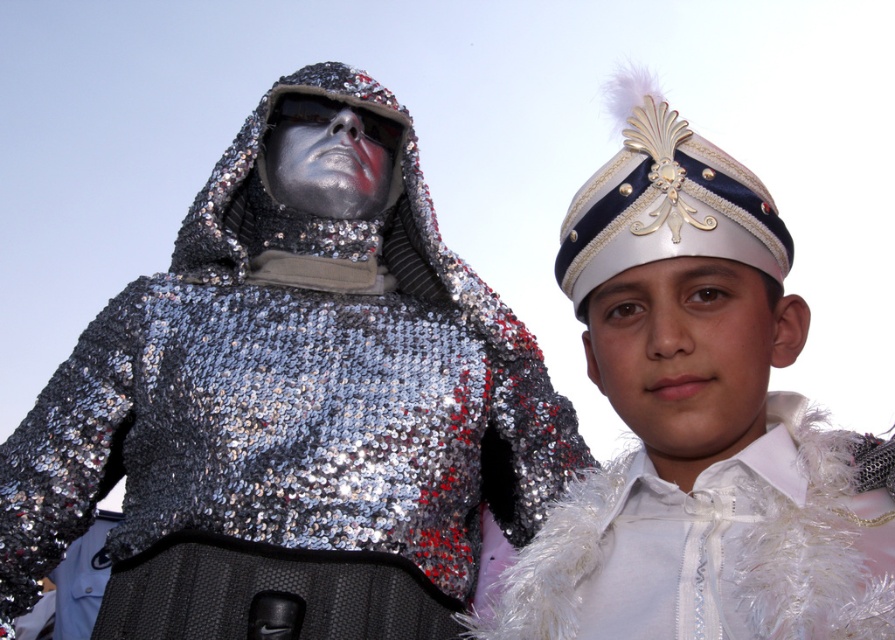
Is shiny metallic armor at left further to the viewer compared to white feathered hat at upper right?

Yes, it is.

The image size is (895, 640). What do you see at coordinates (297, 369) in the screenshot? I see `shiny metallic armor at left` at bounding box center [297, 369].

At what (x,y) coordinates should I click in order to perform the action: click on shiny metallic armor at left. Please return your answer as a coordinate pair (x, y). Looking at the image, I should click on (297, 369).

Measure the distance from shiny metallic armor at left to white satin headdress at upper right.

shiny metallic armor at left is 32.36 feet away from white satin headdress at upper right.

Can you confirm if shiny metallic armor at left is positioned to the right of white satin headdress at upper right?

In fact, shiny metallic armor at left is to the left of white satin headdress at upper right.

Find the location of a particular element. shiny metallic armor at left is located at coordinates (297, 369).

Does white feathered hat at upper right have a greater height compared to white satin headdress at upper right?

Indeed, white feathered hat at upper right has a greater height compared to white satin headdress at upper right.

Who is taller, white feathered hat at upper right or white satin headdress at upper right?

white feathered hat at upper right is taller.

Is point (672, 113) positioned in front of point (684, 252)?

No.

Where is `white feathered hat at upper right`? The image size is (895, 640). white feathered hat at upper right is located at coordinates (696, 420).